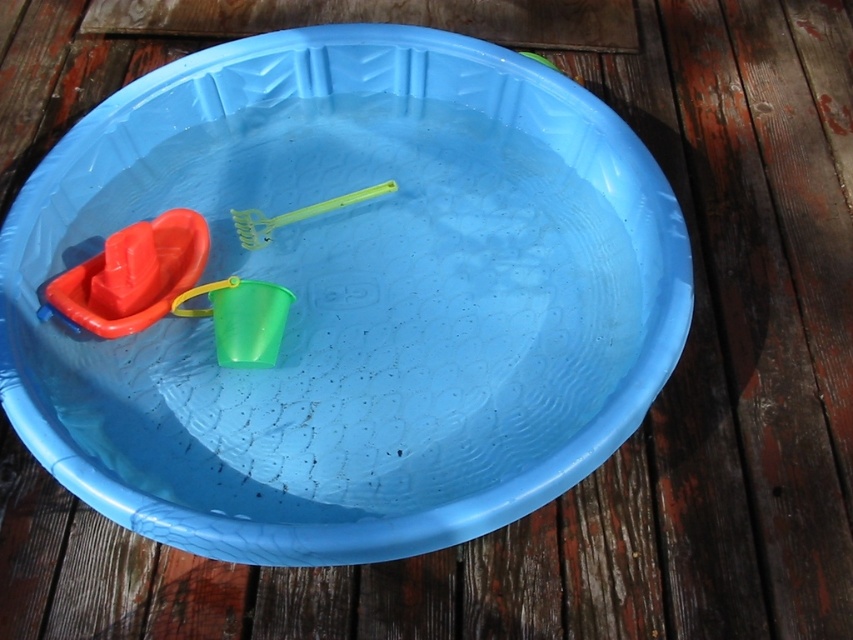
Which of these two, blue plastic bowl at center or matte plastic boat at left, stands shorter?

matte plastic boat at left

Who is positioned more to the right, blue plastic bowl at center or matte plastic boat at left?

blue plastic bowl at center is more to the right.

Locate an element on the screen. This screenshot has width=853, height=640. blue plastic bowl at center is located at coordinates (352, 298).

This screenshot has height=640, width=853. Identify the location of blue plastic bowl at center. (352, 298).

Can you confirm if matte plastic boat at left is wider than translucent green bucket at center?

→ Indeed, matte plastic boat at left has a greater width compared to translucent green bucket at center.

Who is shorter, matte plastic boat at left or translucent green bucket at center?

Standing shorter between the two is translucent green bucket at center.

Between point (123, 321) and point (280, 305), which one is positioned behind?

The point (280, 305) is more distant.

Identify the location of matte plastic boat at left. The width and height of the screenshot is (853, 640). (132, 275).

Which of these two, blue plastic bowl at center or translucent green bucket at center, stands taller?

With more height is blue plastic bowl at center.

Between point (505, 412) and point (277, 344), which one is positioned in front?

Point (505, 412) is in front.

Locate an element on the screen. blue plastic bowl at center is located at coordinates (352, 298).